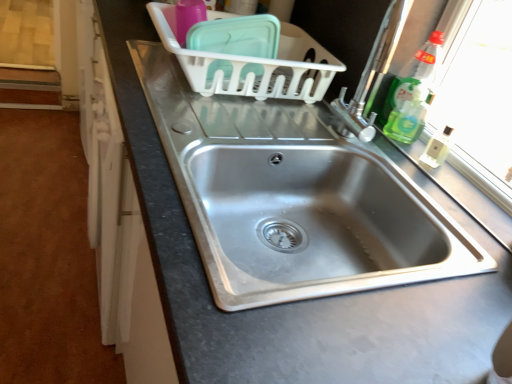
Question: Is the depth of stainless steel sink at center, which is the second sink in bottom-to-top order, less than that of green translucent liquid at right, the second bottle from the top?

Choices:
 (A) yes
 (B) no

Answer: (A)

Question: Can we say stainless steel sink at center, arranged as the first sink when viewed from the top, lies outside green translucent liquid at right, the second bottle from the top?

Choices:
 (A) yes
 (B) no

Answer: (A)

Question: Can you confirm if stainless steel sink at center, which is the second sink in bottom-to-top order, is shorter than green translucent liquid at right, the first bottle from the bottom?

Choices:
 (A) yes
 (B) no

Answer: (B)

Question: Is stainless steel sink at center, which is the second sink in bottom-to-top order, to the left of green translucent liquid at right, the second bottle from the top, from the viewer's perspective?

Choices:
 (A) yes
 (B) no

Answer: (A)

Question: Is stainless steel sink at center, arranged as the first sink when viewed from the top, placed right next to green translucent liquid at right, the second bottle from the top?

Choices:
 (A) yes
 (B) no

Answer: (B)

Question: Would you say green translucent liquid at right, the first bottle from the bottom, is inside or outside stainless steel sink at center, which is the 1th sink from bottom to top?

Choices:
 (A) inside
 (B) outside

Answer: (B)

Question: Looking at the image, does green translucent liquid at right, the second bottle from the top, seem bigger or smaller compared to stainless steel sink at center, which is the 1th sink from bottom to top?

Choices:
 (A) small
 (B) big

Answer: (A)

Question: Is point (412, 107) closer or farther from the camera than point (335, 251)?

Choices:
 (A) closer
 (B) farther

Answer: (B)

Question: Based on their positions, is green translucent liquid at right, the first bottle from the bottom, located to the left or right of stainless steel sink at center, which is the 2th sink from top to bottom?

Choices:
 (A) left
 (B) right

Answer: (B)

Question: From the image's perspective, relative to white plastic basket at upper center, is green translucent liquid at right, the second bottle from the top, above or below?

Choices:
 (A) below
 (B) above

Answer: (A)

Question: Considering the relative positions of green translucent liquid at right, the first bottle from the bottom, and white plastic basket at upper center in the image provided, is green translucent liquid at right, the first bottle from the bottom, to the left or to the right of white plastic basket at upper center?

Choices:
 (A) left
 (B) right

Answer: (B)

Question: From their relative heights in the image, would you say green translucent liquid at right, the second bottle from the top, is taller or shorter than white plastic basket at upper center?

Choices:
 (A) short
 (B) tall

Answer: (A)

Question: Is green translucent liquid at right, the first bottle from the bottom, wider or thinner than white plastic basket at upper center?

Choices:
 (A) wide
 (B) thin

Answer: (B)

Question: Is clear plastic bottle at upper right, the 2th bottle from the bottom, to the left or to the right of stainless steel sink at center, which is the 1th sink from bottom to top, in the image?

Choices:
 (A) left
 (B) right

Answer: (B)

Question: Does point (406, 86) appear closer or farther from the camera than point (325, 155)?

Choices:
 (A) farther
 (B) closer

Answer: (A)